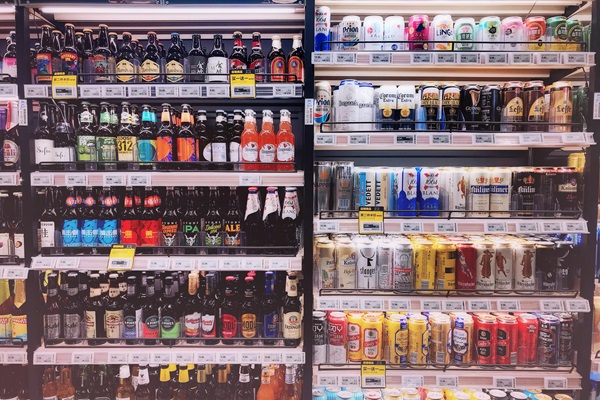
Find the location of `bottles with orange drinks`. bottles with orange drinks is located at coordinates (267, 394), (274, 384), (279, 376), (246, 143), (255, 123), (262, 139), (273, 126), (283, 148), (290, 126).